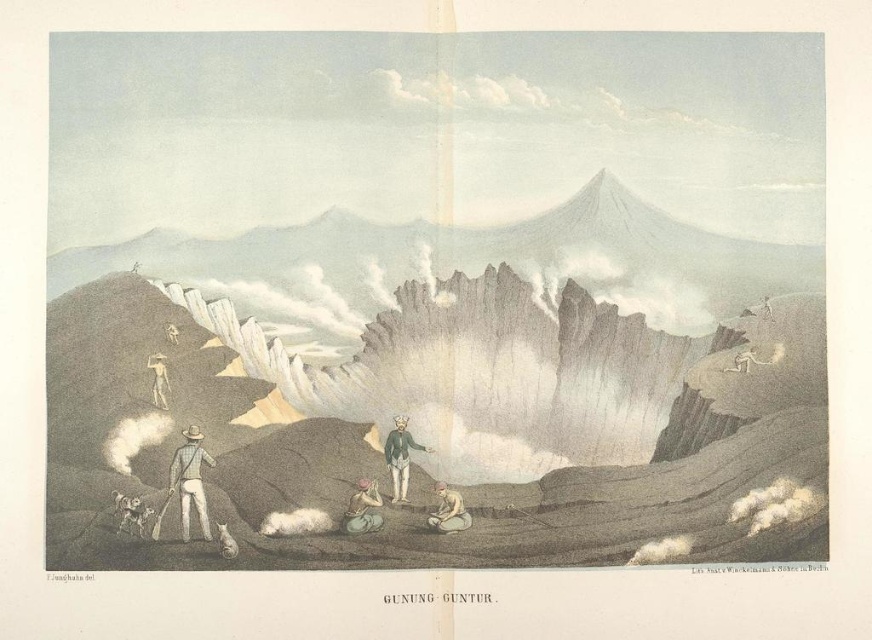
What is the exact 2D coordinate of the blue striped shirt at lower left in the image?

The exact 2D coordinate of the blue striped shirt at lower left is at point [189,481].

You are an observer looking at the volcanic landscape painting. You notice two people in the foreground. The first person wears a blue striped shirt at lower left and the second wears a green fabric jacket at center. Which of these two people is closer to the volcano?

The blue striped shirt at lower left is positioned under green fabric jacket at center, meaning the blue striped shirt at lower left is closer to the volcano.